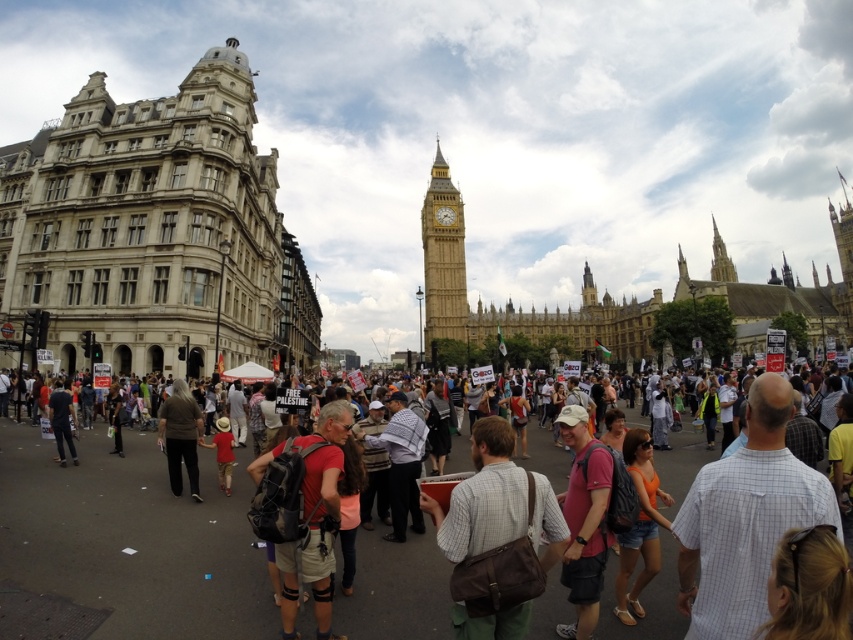
Between pink fabric shirt at center and brown fabric pants at center, which one is positioned lower?

pink fabric shirt at center is lower down.

Who is shorter, pink fabric shirt at center or brown fabric pants at center?

brown fabric pants at center

This screenshot has height=640, width=853. In order to click on pink fabric shirt at center in this screenshot , I will do `click(583, 522)`.

Identify the location of pink fabric shirt at center. (583, 522).

Is golden stone clock tower at center in front of dark blue jeans at center?

That is False.

Is golden stone clock tower at center taller than dark blue jeans at center?

Yes, golden stone clock tower at center is taller than dark blue jeans at center.

Which is behind, point (450, 298) or point (57, 449)?

Positioned behind is point (450, 298).

Where is `golden stone clock tower at center`? The height and width of the screenshot is (640, 853). golden stone clock tower at center is located at coordinates (444, 260).

Can you confirm if brown leather bag at center is positioned above light brown hair at lower right?

Indeed, brown leather bag at center is positioned over light brown hair at lower right.

Does brown leather bag at center come behind light brown hair at lower right?

Yes, brown leather bag at center is further from the viewer.

The width and height of the screenshot is (853, 640). In order to click on brown leather bag at center in this screenshot , I will do `click(496, 502)`.